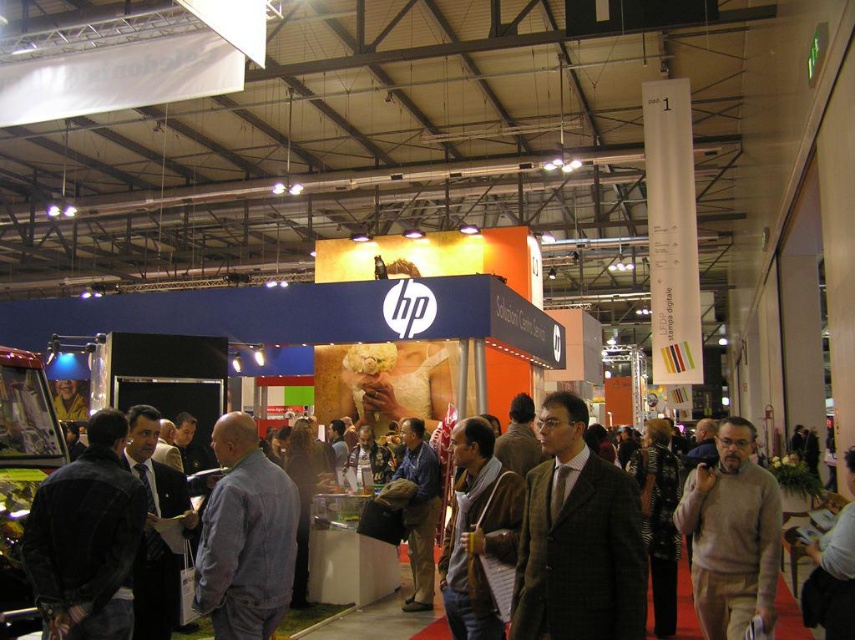
Can you confirm if dark blue denim jacket at left is shorter than blue denim shirt at center?

Yes, dark blue denim jacket at left is shorter than blue denim shirt at center.

Is dark blue denim jacket at left wider than blue denim shirt at center?

Correct, the width of dark blue denim jacket at left exceeds that of blue denim shirt at center.

Between point (110, 480) and point (429, 509), which one is positioned behind?

The point (429, 509) is behind.

At what (x,y) coordinates should I click in order to perform the action: click on dark blue denim jacket at left. Please return your answer as a coordinate pair (x, y). The width and height of the screenshot is (855, 640). Looking at the image, I should click on (86, 538).

Is denim jacket at center thinner than gray sweater at center?

Incorrect, denim jacket at center's width is not less than gray sweater at center's.

Between denim jacket at center and gray sweater at center, which one has more height?

Standing taller between the two is denim jacket at center.

The image size is (855, 640). What do you see at coordinates (245, 536) in the screenshot?
I see `denim jacket at center` at bounding box center [245, 536].

This screenshot has height=640, width=855. I want to click on denim jacket at center, so click(245, 536).

Does denim jacket at center appear on the right side of blue denim shirt at center?

Incorrect, denim jacket at center is not on the right side of blue denim shirt at center.

How distant is denim jacket at center from blue denim shirt at center?

They are 19.85 feet apart.

The width and height of the screenshot is (855, 640). What do you see at coordinates (245, 536) in the screenshot? I see `denim jacket at center` at bounding box center [245, 536].

Locate an element on the screen. This screenshot has width=855, height=640. denim jacket at center is located at coordinates (245, 536).